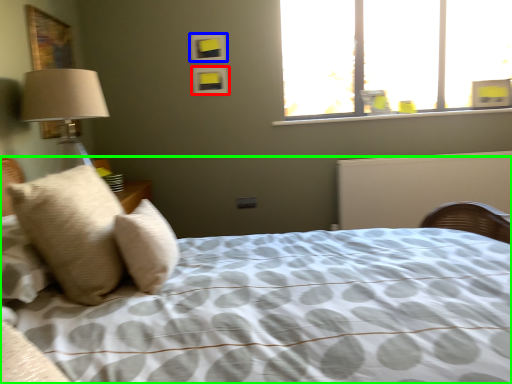
Question: Which object is positioned closest to picture frame (highlighted by a red box)? Select from picture frame (highlighted by a blue box) and bed (highlighted by a green box).

Choices:
 (A) picture frame
 (B) bed

Answer: (A)